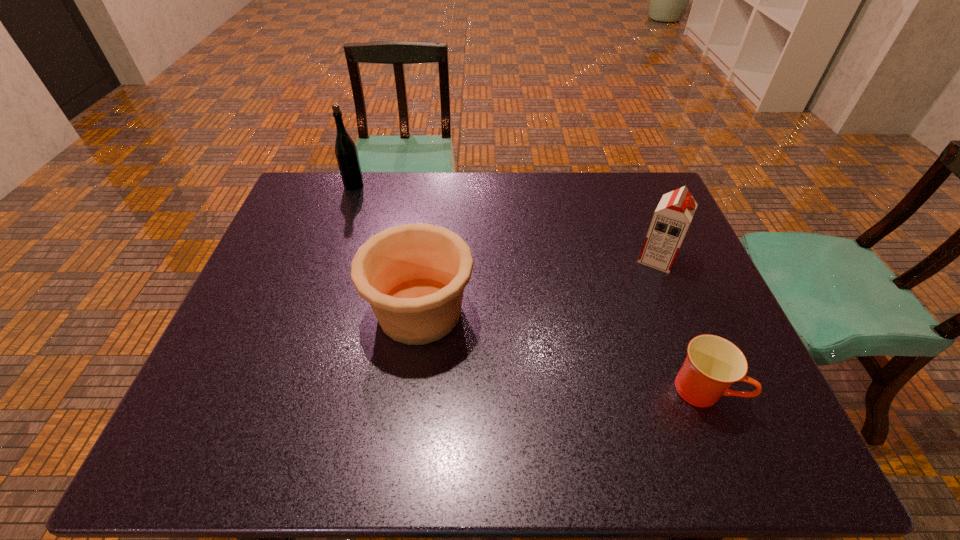
In the image, there is a desktop. Where is `blank space at the far left corner`? The image size is (960, 540). blank space at the far left corner is located at coordinates (320, 190).

Where is `blank space at the far right corner of the desktop`? blank space at the far right corner of the desktop is located at coordinates (639, 187).

Identify the location of vacant space that's between the cup and the leftmost object. (528, 287).

This screenshot has width=960, height=540. I want to click on vacant area between the beer bottle and the cup, so click(x=528, y=287).

The height and width of the screenshot is (540, 960). I want to click on free spot between the third shortest object and the cup, so click(x=680, y=324).

At what (x,y) coordinates should I click in order to perform the action: click on vacant space in between the second farthest object and the farthest object. Please return your answer as a coordinate pair (x, y). Image resolution: width=960 pixels, height=540 pixels. Looking at the image, I should click on (506, 222).

Locate an element on the screen. This screenshot has height=540, width=960. unoccupied area between the leftmost object and the second farthest object is located at coordinates (506, 222).

At what (x,y) coordinates should I click in order to perform the action: click on free space between the nearest object and the second tallest object. Please return your answer as a coordinate pair (x, y). Image resolution: width=960 pixels, height=540 pixels. Looking at the image, I should click on coord(680,324).

Locate an element on the screen. This screenshot has height=540, width=960. free space between the shortest object and the soya milk is located at coordinates (680, 324).

This screenshot has width=960, height=540. I want to click on vacant region between the second tallest object and the leftmost object, so click(506, 222).